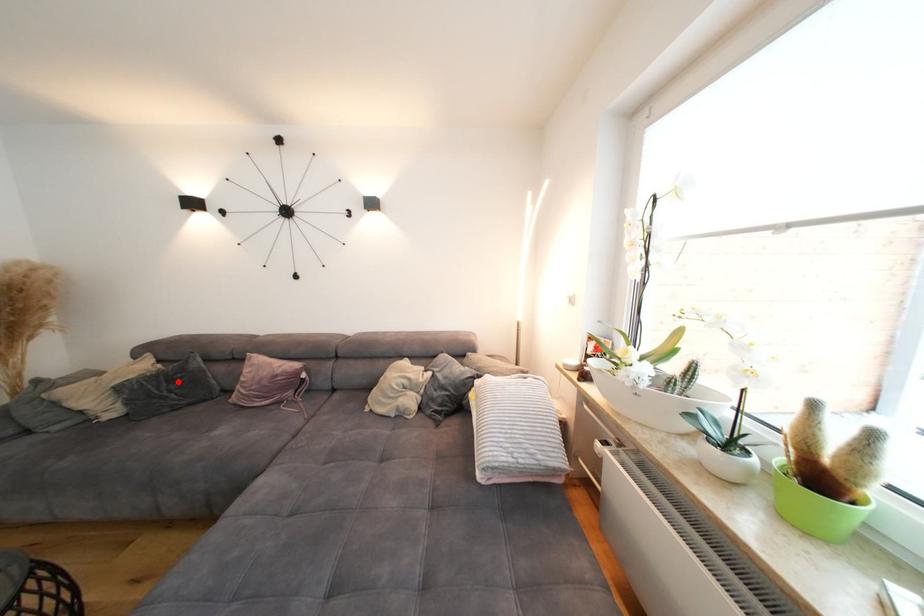
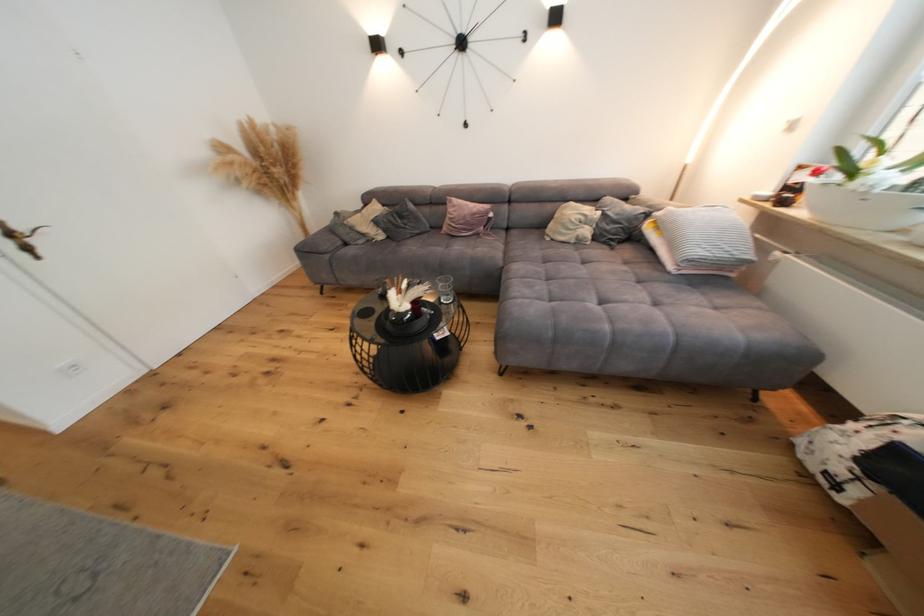
Question: I am providing you with two images of the same scene from different viewpoints. In image1, a red point is highlighted. Considering the same 3D point in image2, which of the following is correct?

Choices:
 (A) It is closer
 (B) It is farther

Answer: (A)